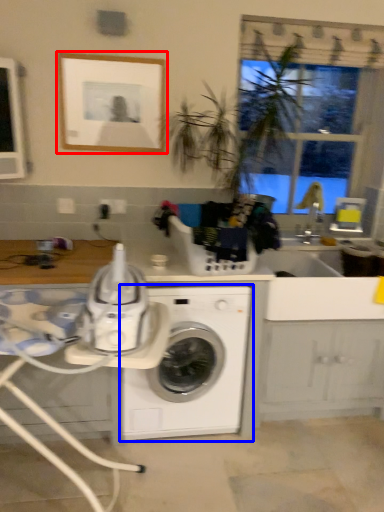
Question: Which object is further to the camera taking this photo, picture frame (highlighted by a red box) or washing machine (highlighted by a blue box)?

Choices:
 (A) picture frame
 (B) washing machine

Answer: (A)